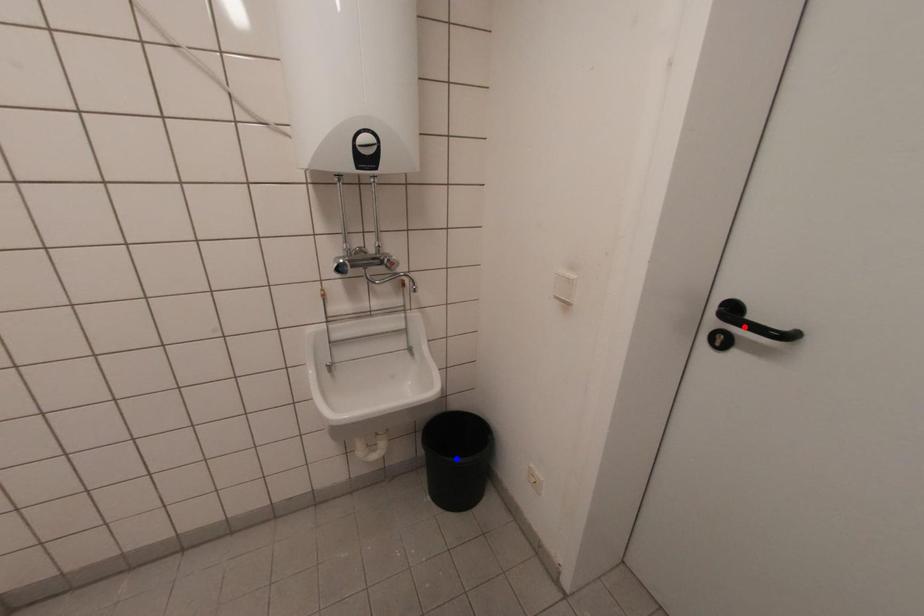
Question: In the image, two points are highlighted. Which point is nearer to the camera? Reply with the corresponding letter.

Choices:
 (A) blue point
 (B) red point

Answer: (B)